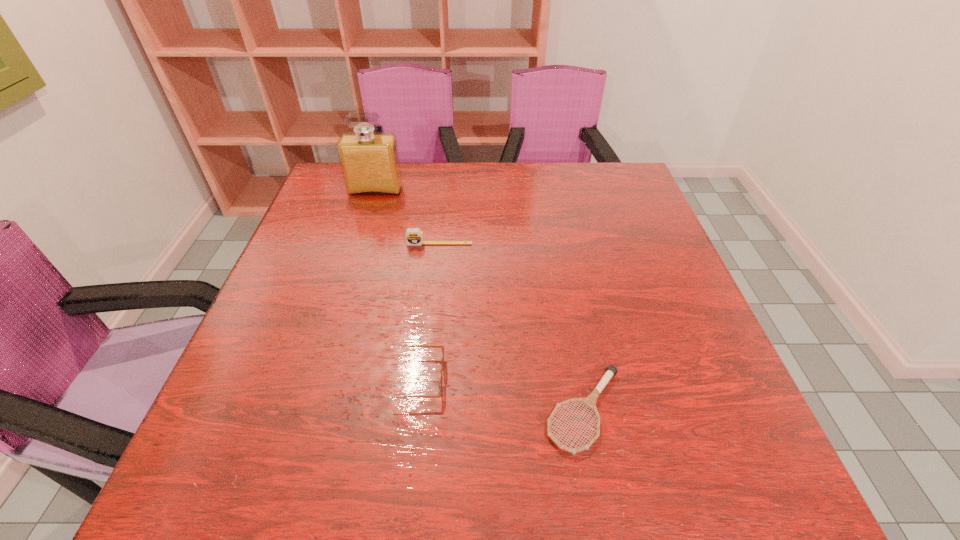
Locate an element on the screen. The image size is (960, 540). free space between the sunglasses and the rightmost object is located at coordinates (499, 394).

The height and width of the screenshot is (540, 960). What are the coordinates of `vacant point located between the tennis racket and the leftmost object` in the screenshot? It's located at (480, 300).

Find the location of `vacant area between the tape measure and the tennis racket`. vacant area between the tape measure and the tennis racket is located at coordinates (512, 327).

Locate an element on the screen. This screenshot has width=960, height=540. free space between the second farthest object and the leftmost object is located at coordinates (407, 217).

I want to click on vacant point located between the rightmost object and the leftmost object, so click(480, 300).

The height and width of the screenshot is (540, 960). Identify the location of vacant space that's between the leftmost object and the shortest object. (480, 300).

Locate an element on the screen. This screenshot has height=540, width=960. free spot between the sunglasses and the rightmost object is located at coordinates (499, 394).

Locate an element on the screen. The height and width of the screenshot is (540, 960). vacant area between the rightmost object and the sunglasses is located at coordinates (499, 394).

Where is `free spot between the tennis racket and the perfume`? free spot between the tennis racket and the perfume is located at coordinates (480, 300).

Find the location of a particular element. The width and height of the screenshot is (960, 540). unoccupied position between the tape measure and the sunglasses is located at coordinates (426, 311).